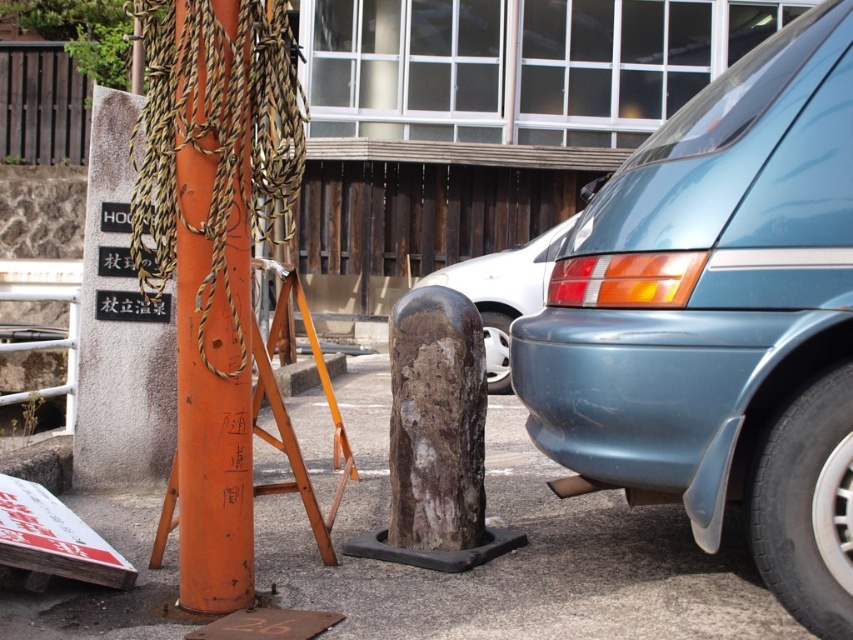
You are standing at the point marked by the coordinates point (720, 320). What object is directly to your right?

The teal glossy minivan at right is directly to your right.

You are a delivery driver who needs to park your teal glossy minivan at right near the orange painted wood post at left. Based on the scene, is there enough vertical space between the minivan and the post to park your vehicle without hitting the post?

The teal glossy minivan at right is located above the orange painted wood post at left, so there is sufficient vertical space between them. You can park the teal glossy minivan at right near the orange painted wood post at left without hitting the post.